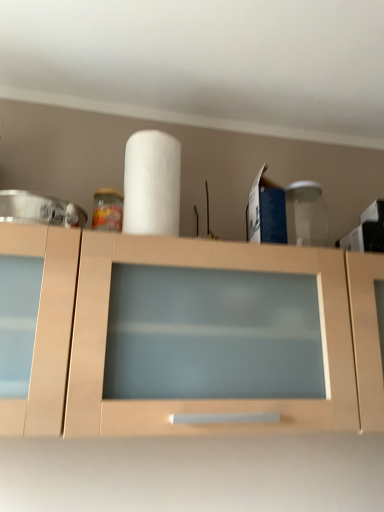
Question: Is white matte paper towel at center facing away from matte wood cabinet at center?

Choices:
 (A) no
 (B) yes

Answer: (A)

Question: Considering the relative sizes of white matte paper towel at center and matte wood cabinet at center in the image provided, is white matte paper towel at center bigger than matte wood cabinet at center?

Choices:
 (A) yes
 (B) no

Answer: (B)

Question: Does white matte paper towel at center have a lesser width compared to matte wood cabinet at center?

Choices:
 (A) no
 (B) yes

Answer: (B)

Question: Is white matte paper towel at center aimed at matte wood cabinet at center?

Choices:
 (A) no
 (B) yes

Answer: (A)

Question: Can you confirm if white matte paper towel at center is positioned to the left of matte wood cabinet at center?

Choices:
 (A) no
 (B) yes

Answer: (B)

Question: Is white matte paper towel at center far away from matte wood cabinet at center?

Choices:
 (A) yes
 (B) no

Answer: (B)

Question: Is matte wood cabinet at center aimed at white matte paper towel at center?

Choices:
 (A) yes
 (B) no

Answer: (B)

Question: Does matte wood cabinet at center have a larger size compared to white matte paper towel at center?

Choices:
 (A) no
 (B) yes

Answer: (B)

Question: From the image's perspective, would you say matte wood cabinet at center is positioned over white matte paper towel at center?

Choices:
 (A) yes
 (B) no

Answer: (B)

Question: Is matte wood cabinet at center thinner than white matte paper towel at center?

Choices:
 (A) yes
 (B) no

Answer: (B)

Question: Is matte wood cabinet at center smaller than white matte paper towel at center?

Choices:
 (A) no
 (B) yes

Answer: (A)

Question: Is matte wood cabinet at center positioned before white matte paper towel at center?

Choices:
 (A) no
 (B) yes

Answer: (B)

Question: Considering the positions of matte wood cabinet at center and white matte paper towel at center in the image, is matte wood cabinet at center wider or thinner than white matte paper towel at center?

Choices:
 (A) wide
 (B) thin

Answer: (A)